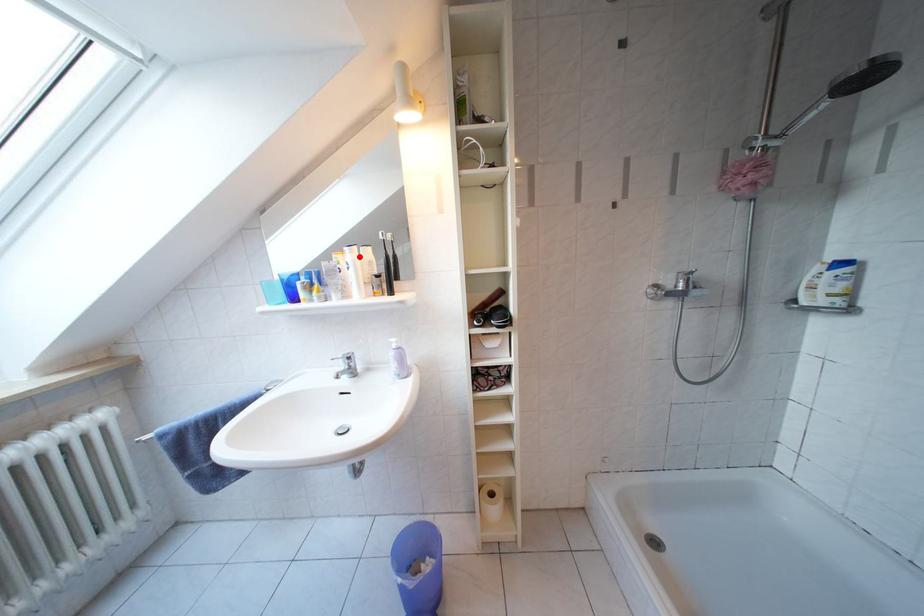
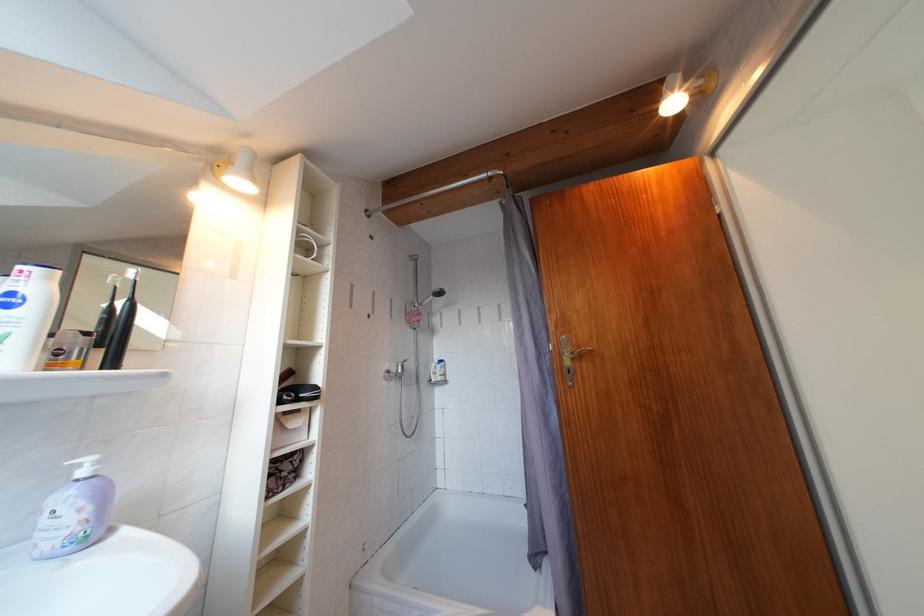
The point at the highlighted location is marked in the first image. Where is the corresponding point in the second image?

(56, 283)